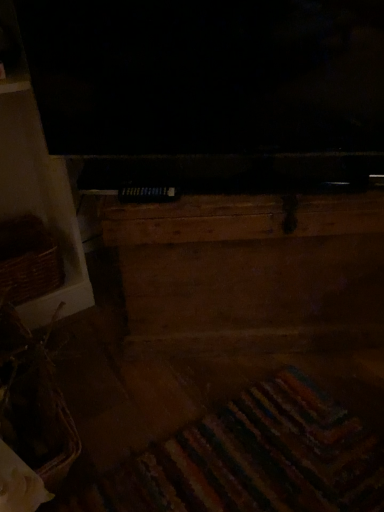
Question: Considering the relative sizes of woven brown basket at lower left, arranged as the 1th basket when ordered from the bottom, and wooden chest at center in the image provided, is woven brown basket at lower left, arranged as the 1th basket when ordered from the bottom, smaller than wooden chest at center?

Choices:
 (A) yes
 (B) no

Answer: (A)

Question: Does woven brown basket at lower left, arranged as the 1th basket when ordered from the bottom, have a larger size compared to wooden chest at center?

Choices:
 (A) no
 (B) yes

Answer: (A)

Question: From a real-world perspective, is woven brown basket at lower left, which is the second basket from top to bottom, positioned over wooden chest at center based on gravity?

Choices:
 (A) yes
 (B) no

Answer: (B)

Question: From a real-world perspective, is woven brown basket at lower left, placed as the 2th basket when sorted from back to front, positioned under wooden chest at center based on gravity?

Choices:
 (A) no
 (B) yes

Answer: (B)

Question: Considering the relative sizes of woven brown basket at lower left, which is the second basket from top to bottom, and wooden chest at center in the image provided, is woven brown basket at lower left, which is the second basket from top to bottom, wider than wooden chest at center?

Choices:
 (A) no
 (B) yes

Answer: (A)

Question: Is woven brown basket at lower left, placed as the 2th basket when sorted from back to front, with wooden chest at center?

Choices:
 (A) yes
 (B) no

Answer: (B)

Question: Can you confirm if wooden chest at center is thinner than woven brown basket at lower left, which is the second basket from top to bottom?

Choices:
 (A) yes
 (B) no

Answer: (B)

Question: Is wooden chest at center further to the viewer compared to woven brown basket at lower left, placed as the 2th basket when sorted from back to front?

Choices:
 (A) no
 (B) yes

Answer: (B)

Question: Is woven brown basket at lower left, which is the second basket from top to bottom, located within wooden chest at center?

Choices:
 (A) yes
 (B) no

Answer: (B)

Question: Does wooden chest at center turn towards woven brown basket at lower left, which is the second basket from top to bottom?

Choices:
 (A) no
 (B) yes

Answer: (B)

Question: Does wooden chest at center lie in front of woven brown basket at lower left, placed as the 2th basket when sorted from back to front?

Choices:
 (A) no
 (B) yes

Answer: (A)

Question: Is wooden chest at center not within woven brown basket at lower left, placed as the 2th basket when sorted from back to front?

Choices:
 (A) yes
 (B) no

Answer: (A)

Question: Is wooden chest at center oriented towards brown woven basket at left, the 1th basket from the top?

Choices:
 (A) yes
 (B) no

Answer: (B)